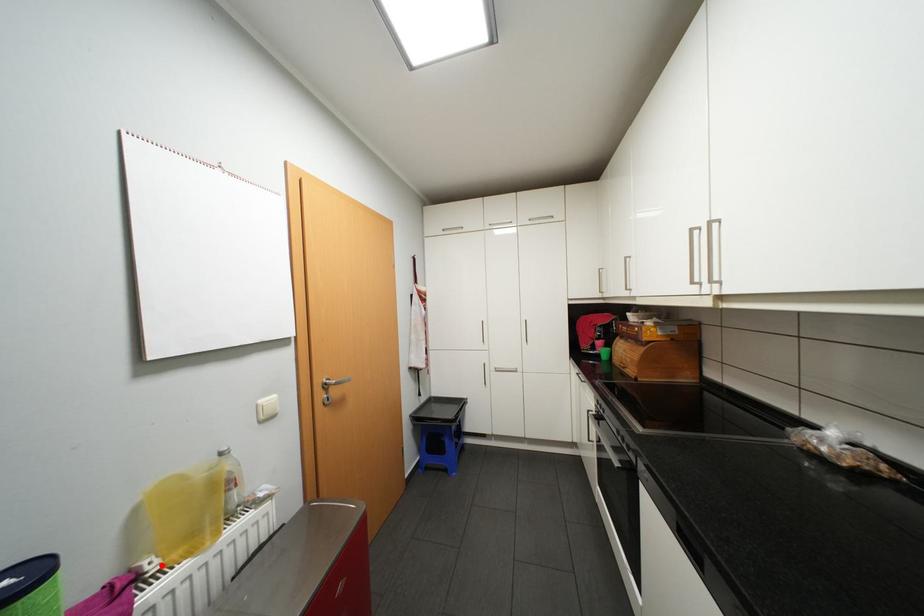
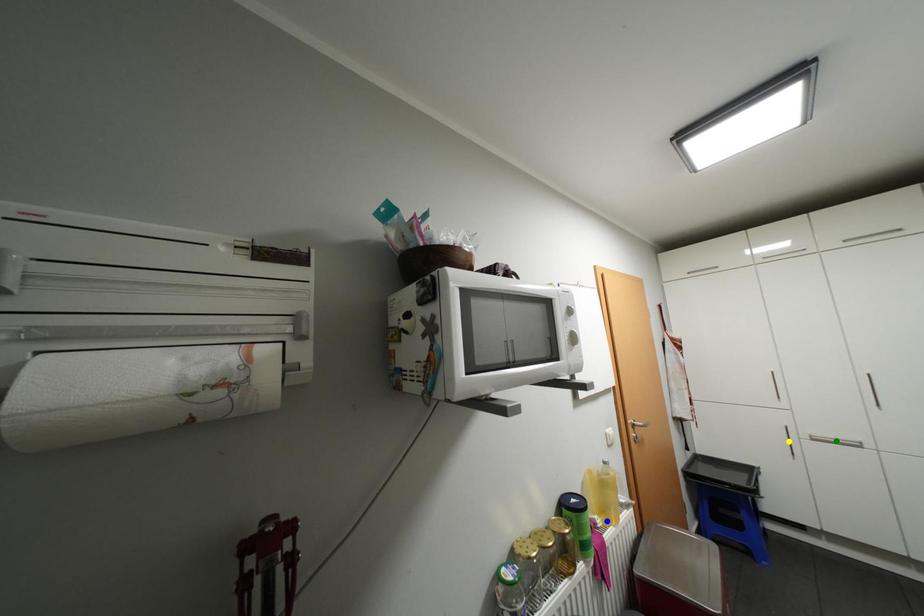
Question: I am providing you with two images of the same scene from different viewpoints. A red point is marked on the first image. You are given multiple points on the second image. In image 2, which mark is for the same physical point as the one in image 1?

Choices:
 (A) yellow point
 (B) green point
 (C) blue point

Answer: (C)